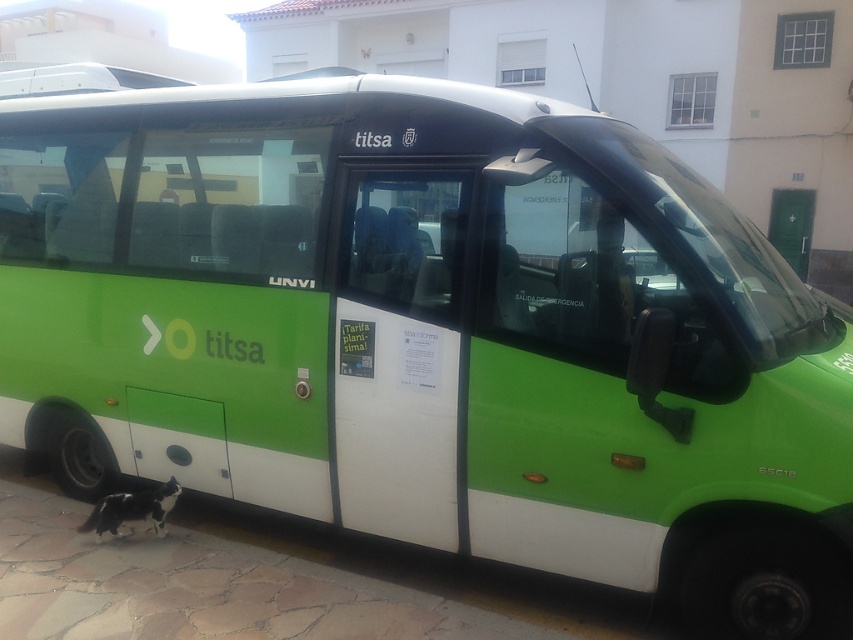
You are a delivery person trying to park your van next to the black rubber curb at lower left and the black and white fur cat at lower left. Which object should you avoid hitting to prevent damage to your van?

You should avoid hitting the black rubber curb at lower left because it has a larger size compared to the black and white fur cat at lower left, making it more likely to cause damage to your van.

You are a delivery person trying to park your van next to the black rubber curb at lower left. There is a black and white fur cat at lower left nearby. How far apart are the cat and the curb?

The black rubber curb at lower left and the black and white fur cat at lower left are 19.45 inches apart.

You are a delivery person standing next to the black rubber curb at lower left and the black and white fur cat at lower left. You need to place a box on the highest point between them. Which one should you choose?

The black and white fur cat at lower left is taller than the black rubber curb at lower left, so you should place the box on the black and white fur cat at lower left.